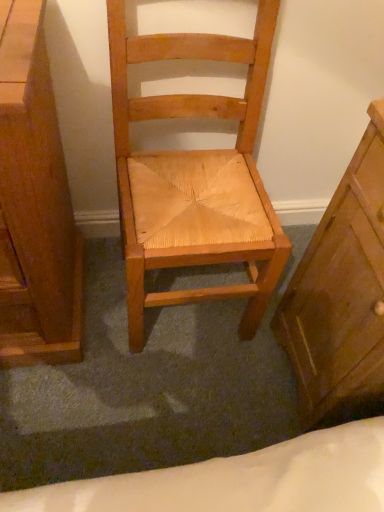
Question: Is natural wood chair at center next to wooden chest of drawers at left, marked as the 2th chest of drawers in a right-to-left arrangement, and touching it?

Choices:
 (A) no
 (B) yes

Answer: (A)

Question: Is natural wood chair at center positioned with its back to wooden chest of drawers at left, which is the 1th chest of drawers from left to right?

Choices:
 (A) yes
 (B) no

Answer: (B)

Question: Is natural wood chair at center closer to camera compared to wooden chest of drawers at left, which is the 1th chest of drawers from left to right?

Choices:
 (A) no
 (B) yes

Answer: (A)

Question: Are natural wood chair at center and wooden chest of drawers at left, which is the 1th chest of drawers from left to right, located far from each other?

Choices:
 (A) yes
 (B) no

Answer: (B)

Question: Considering the relative sizes of natural wood chair at center and wooden chest of drawers at left, marked as the 2th chest of drawers in a right-to-left arrangement, in the image provided, is natural wood chair at center taller than wooden chest of drawers at left, marked as the 2th chest of drawers in a right-to-left arrangement,?

Choices:
 (A) yes
 (B) no

Answer: (A)

Question: Does point (299, 411) appear closer or farther from the camera than point (23, 156)?

Choices:
 (A) farther
 (B) closer

Answer: (A)

Question: Is wooden chest of drawers at right, which is the 1th chest of drawers from right to left, taller or shorter than wooden chest of drawers at left, marked as the 2th chest of drawers in a right-to-left arrangement?

Choices:
 (A) short
 (B) tall

Answer: (A)

Question: Would you say wooden chest of drawers at right, which is the 1th chest of drawers from right to left, is inside or outside wooden chest of drawers at left, marked as the 2th chest of drawers in a right-to-left arrangement?

Choices:
 (A) inside
 (B) outside

Answer: (B)

Question: Looking at the image, does wooden chest of drawers at right, the second chest of drawers when ordered from left to right, seem bigger or smaller compared to wooden chest of drawers at left, marked as the 2th chest of drawers in a right-to-left arrangement?

Choices:
 (A) small
 (B) big

Answer: (A)

Question: Based on their positions, is natural wood chair at center located to the left or right of wooden chest of drawers at right, which is the 1th chest of drawers from right to left?

Choices:
 (A) left
 (B) right

Answer: (A)

Question: In terms of size, does natural wood chair at center appear bigger or smaller than wooden chest of drawers at right, the second chest of drawers when ordered from left to right?

Choices:
 (A) small
 (B) big

Answer: (B)

Question: Relative to wooden chest of drawers at right, which is the 1th chest of drawers from right to left, is natural wood chair at center in front or behind?

Choices:
 (A) behind
 (B) front

Answer: (A)

Question: From a real-world perspective, is natural wood chair at center above or below wooden chest of drawers at right, the second chest of drawers when ordered from left to right?

Choices:
 (A) above
 (B) below

Answer: (A)

Question: Considering the positions of wooden chest of drawers at left, marked as the 2th chest of drawers in a right-to-left arrangement, and natural wood chair at center in the image, is wooden chest of drawers at left, marked as the 2th chest of drawers in a right-to-left arrangement, wider or thinner than natural wood chair at center?

Choices:
 (A) wide
 (B) thin

Answer: (A)

Question: Is wooden chest of drawers at left, which is the 1th chest of drawers from left to right, to the left or to the right of natural wood chair at center in the image?

Choices:
 (A) left
 (B) right

Answer: (A)